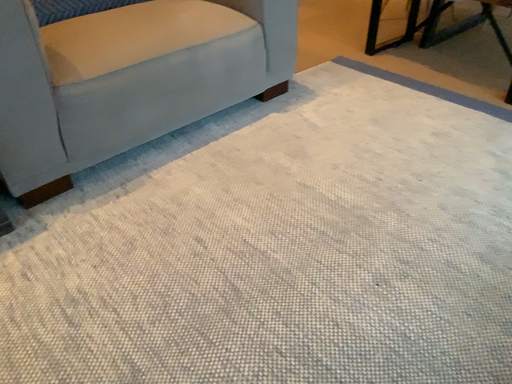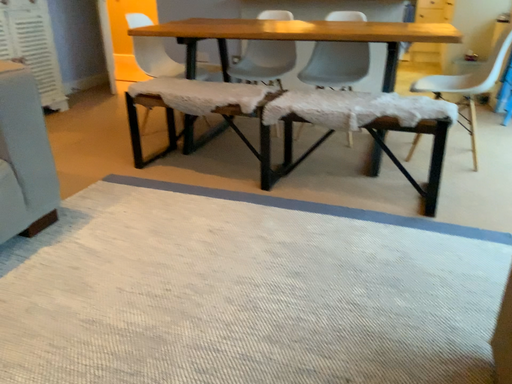
Question: Which way did the camera rotate in the video?

Choices:
 (A) rotated left
 (B) rotated right

Answer: (B)